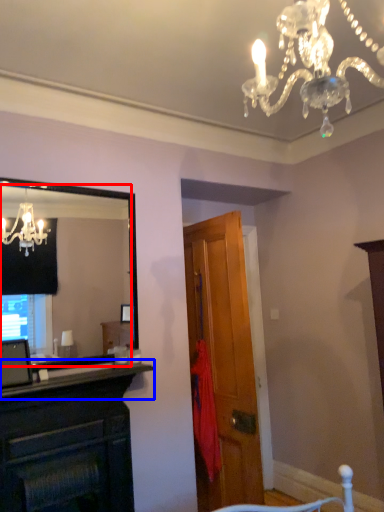
Question: Among these objects, which one is farthest to the camera, mirror (highlighted by a red box) or mantle (highlighted by a blue box)?

Choices:
 (A) mirror
 (B) mantle

Answer: (A)